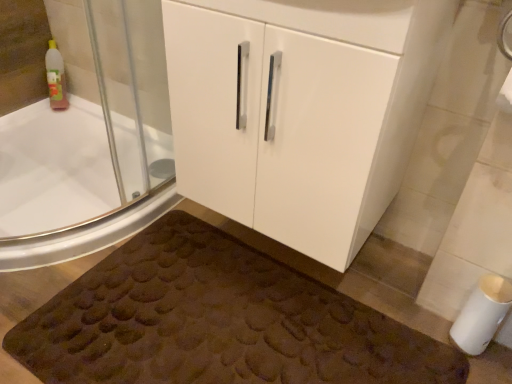
At what (x,y) coordinates should I click in order to perform the action: click on vacant point to the left of white matte toilet paper at lower right. Please return your answer as a coordinate pair (x, y). This screenshot has height=384, width=512. Looking at the image, I should click on (414, 326).